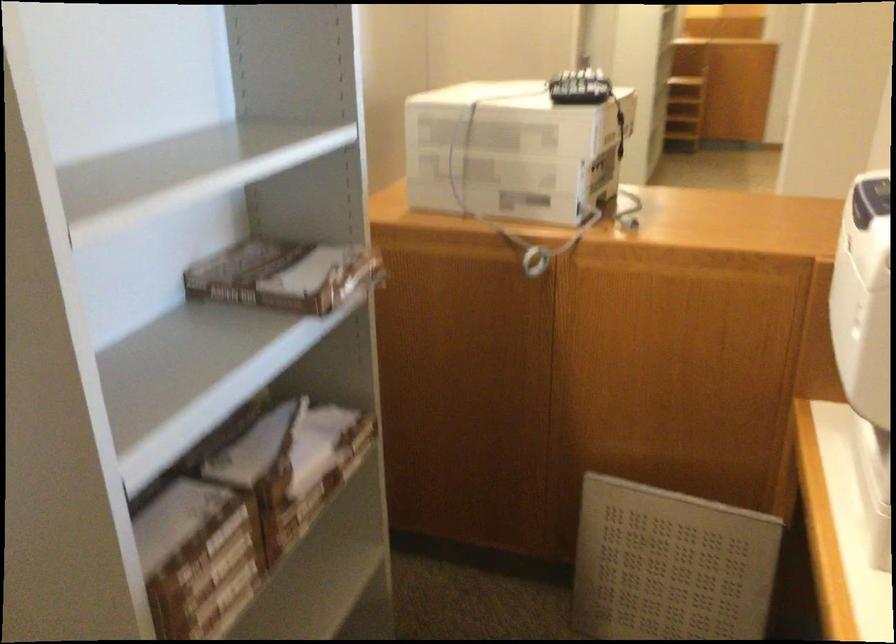
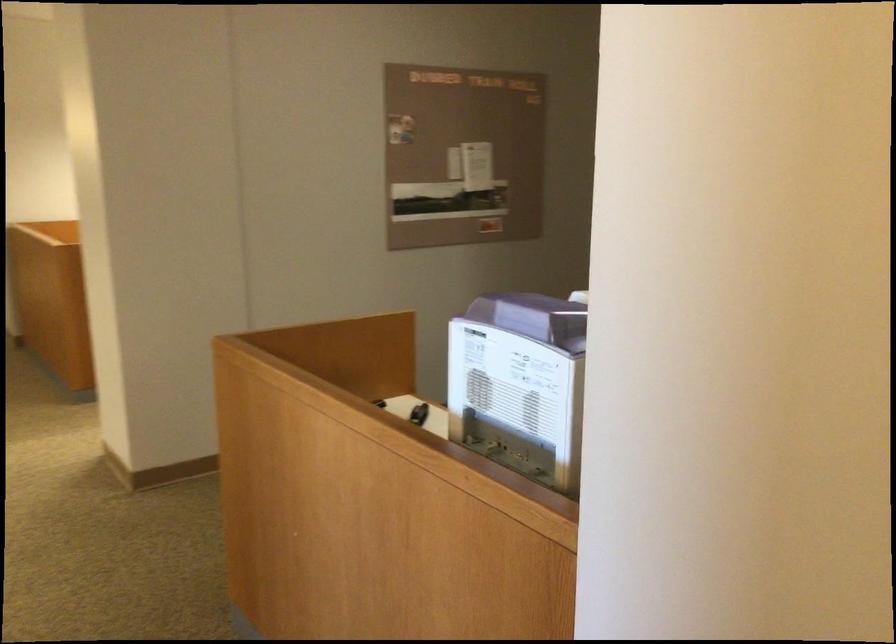
Question: I am providing you with two images of the same scene from different viewpoints. After the viewpoint changes to image2, which objects are now occluded?

Choices:
 (A) purple machine lid
 (B) woven round lid
 (C) small black object
 (D) brown cardboard box

Answer: (D)